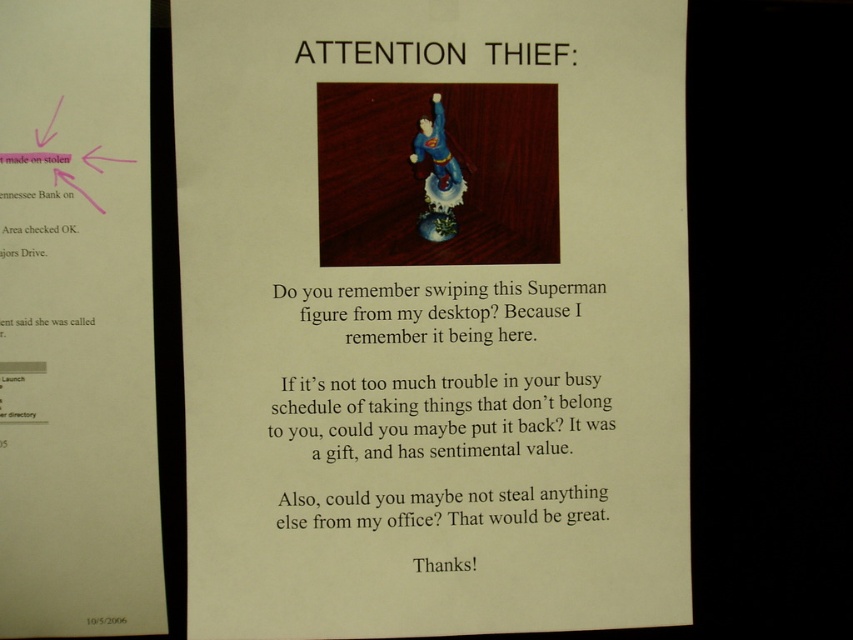
Which is below, matte paper poster at upper left or matte plastic superman figure at center?

matte plastic superman figure at center

Who is shorter, matte paper poster at upper left or matte plastic superman figure at center?

With less height is matte plastic superman figure at center.

The height and width of the screenshot is (640, 853). Find the location of `matte paper poster at upper left`. matte paper poster at upper left is located at coordinates (76, 323).

Between porcelain superman figure at center and matte plastic superman figure at center, which one has more height?

porcelain superman figure at center

Is point (241, 308) closer to viewer compared to point (378, 497)?

Yes, point (241, 308) is closer to viewer.

Which is in front, point (206, 240) or point (450, 360)?

Point (206, 240) is in front.

Locate an element on the screen. Image resolution: width=853 pixels, height=640 pixels. porcelain superman figure at center is located at coordinates (432, 316).

How distant is porcelain superman figure at center from matte paper poster at upper left?

porcelain superman figure at center is 4.52 inches from matte paper poster at upper left.

Locate an element on the screen. porcelain superman figure at center is located at coordinates (432, 316).

Between point (611, 104) and point (165, 616), which one is positioned behind?

Positioned behind is point (611, 104).

What are the coordinates of `porcelain superman figure at center` in the screenshot? It's located at (432, 316).